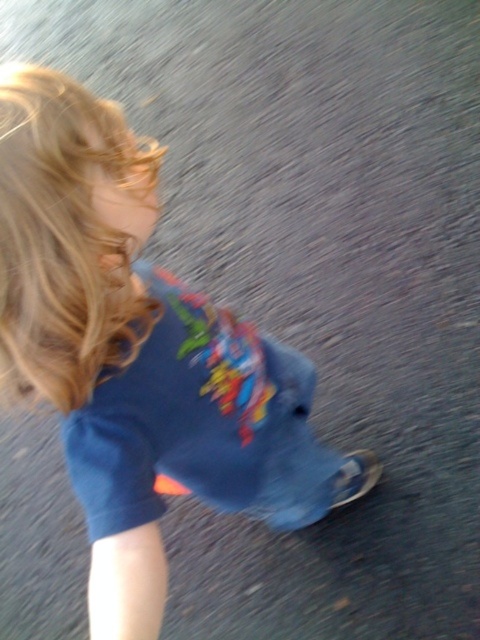
You are a photographer trying to capture the perfect shot of the blue cotton shirt at center and the blonde curly hair at upper left. Which object should you focus on if you want to ensure that the wider one is in sharp focus?

The blue cotton shirt at center is wider than the blonde curly hair at upper left, so you should focus on the blue cotton shirt at center to ensure it is in sharp focus.

You are standing at the origin point in the image. There is a blue cotton shirt at center located at point (139, 353). If you want to walk towards it, which direction should you move?

The blue cotton shirt at center is located at point (139, 353), so you should move northeast to reach it.